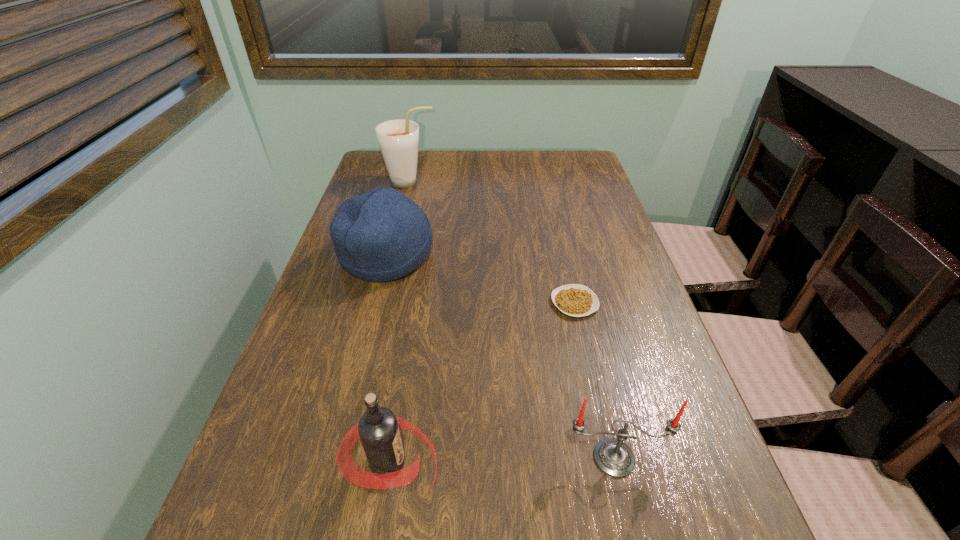
Locate an element on the screen. The width and height of the screenshot is (960, 540). free space between the nearer root beer and the legume is located at coordinates pos(482,383).

You are a GUI agent. You are given a task and a screenshot of the screen. Output one action in this format:
    pyautogui.click(x=<x>, y=<y>)
    Task: Click on the free spot between the shorter root beer and the farthest object
    Image resolution: width=960 pixels, height=540 pixels.
    Given the screenshot: What is the action you would take?
    pyautogui.click(x=399, y=322)

This screenshot has width=960, height=540. I want to click on free space between the shorter root beer and the legume, so 482,383.

At what (x,y) coordinates should I click in order to perform the action: click on vacant area between the skullcap and the legume. Please return your answer as a coordinate pair (x, y). Image resolution: width=960 pixels, height=540 pixels. Looking at the image, I should click on (480, 280).

You are a GUI agent. You are given a task and a screenshot of the screen. Output one action in this format:
    pyautogui.click(x=<x>, y=<y>)
    Task: Click on the unoccupied area between the shorter root beer and the candle
    
    Given the screenshot: What is the action you would take?
    pyautogui.click(x=501, y=460)

Find the location of a particular element. The image size is (960, 540). vacant point located between the shortest object and the tallest object is located at coordinates (492, 242).

In order to click on unoccupied position between the shortest object and the skullcap in this screenshot , I will do `click(480, 280)`.

I want to click on vacant point located between the candle and the farther root beer, so click(x=512, y=320).

You are a GUI agent. You are given a task and a screenshot of the screen. Output one action in this format:
    pyautogui.click(x=<x>, y=<y>)
    Task: Click on the empty space that is in between the skullcap and the candle
    This screenshot has width=960, height=540.
    Given the screenshot: What is the action you would take?
    pyautogui.click(x=500, y=357)

Where is `free space between the shorter root beer and the legume`? This screenshot has height=540, width=960. free space between the shorter root beer and the legume is located at coordinates (482, 383).